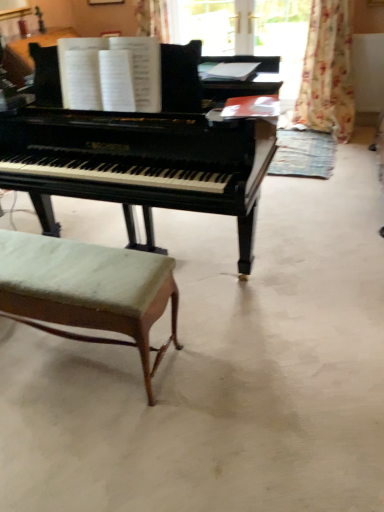
Where is `unoccupied area in front of green fabric stool at lower left`? unoccupied area in front of green fabric stool at lower left is located at coordinates (79, 436).